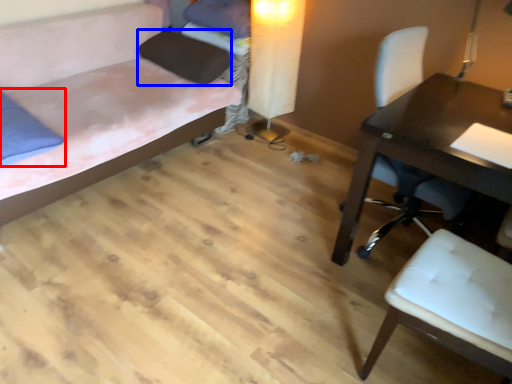
Question: Among these objects, which one is nearest to the camera, pillow (highlighted by a red box) or pillow (highlighted by a blue box)?

Choices:
 (A) pillow
 (B) pillow

Answer: (A)